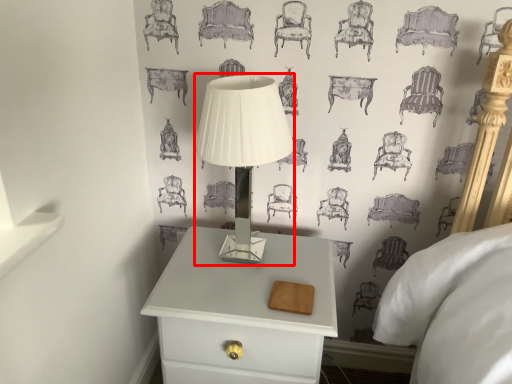
Question: Observing the image, what is the correct spatial positioning of table lamp (annotated by the red box) in reference to nightstand?

Choices:
 (A) left
 (B) right

Answer: (A)